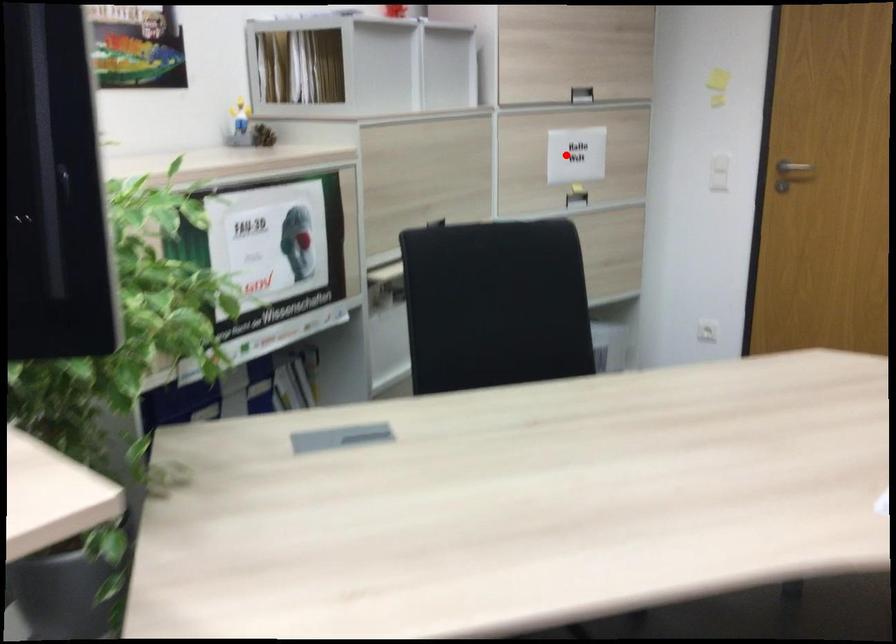
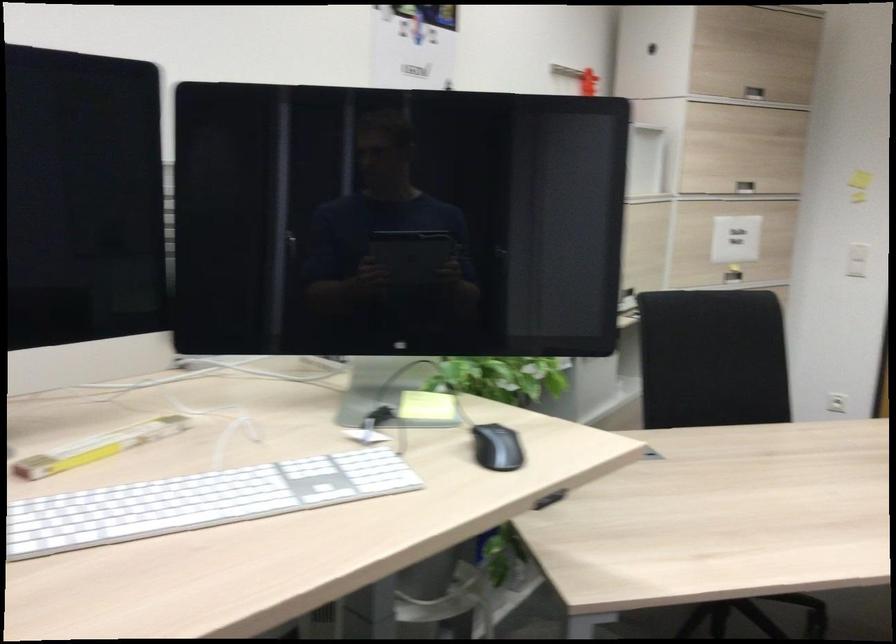
Question: A red point is marked in image1. In image2, is the corresponding 3D point closer to the camera or farther? Reply with the corresponding letter.

Choices:
 (A) The corresponding 3D point is closer.
 (B) The corresponding 3D point is farther.

Answer: (B)